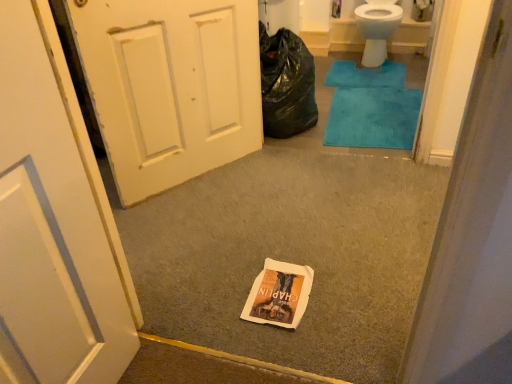
Locate an element on the screen. vacant area that is situated to the right of white painted wood door at left is located at coordinates (281, 177).